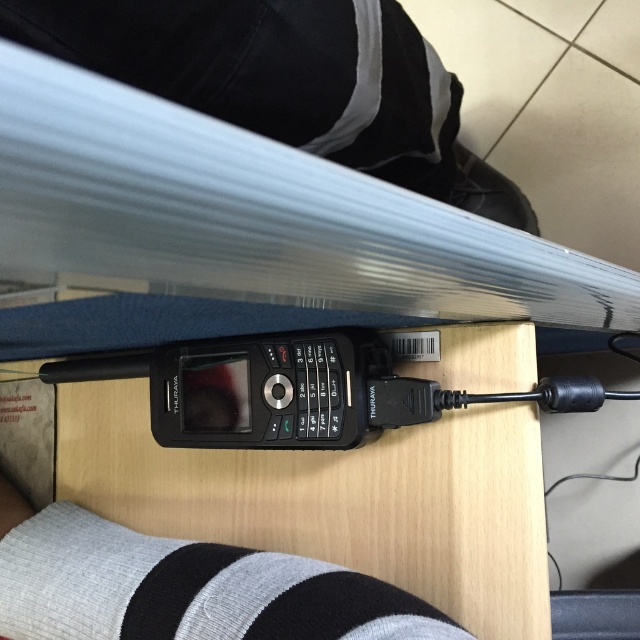
Question: Is black fabric pants at lower center smaller than gray knitted sock at lower center?

Choices:
 (A) yes
 (B) no

Answer: (B)

Question: Observing the image, what is the correct spatial positioning of black fabric pants at lower center in reference to gray knitted sock at lower center?

Choices:
 (A) below
 (B) above

Answer: (B)

Question: Which of the following is the closest to the observer?

Choices:
 (A) gray knitted sock at lower center
 (B) black fabric pants at lower center

Answer: (B)

Question: Which point is farther from the camera taking this photo?

Choices:
 (A) (401, 154)
 (B) (381, 612)

Answer: (A)

Question: Which point is farther from the camera taking this photo?

Choices:
 (A) (451, 179)
 (B) (113, 588)

Answer: (A)

Question: Is black fabric pants at lower center bigger than gray knitted sock at lower center?

Choices:
 (A) yes
 (B) no

Answer: (A)